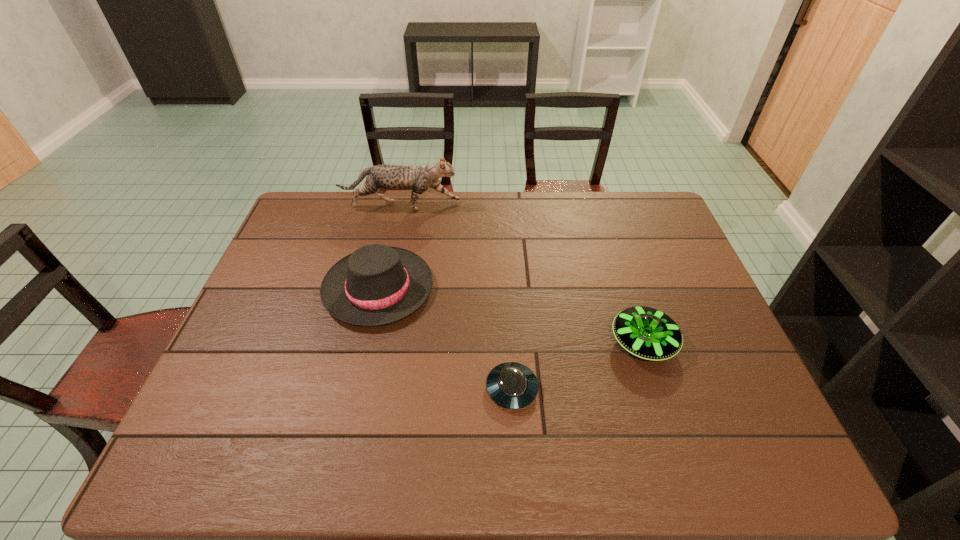
Find the location of a particular element. vacant space located 0.210m on the back of the second object from right to left is located at coordinates (507, 304).

You are a GUI agent. You are given a task and a screenshot of the screen. Output one action in this format:
    pyautogui.click(x=<x>, y=<y>)
    Task: Click on the object that is at the far edge
    
    Given the screenshot: What is the action you would take?
    pyautogui.click(x=380, y=178)

Identify the location of object that is at the left edge. This screenshot has height=540, width=960. (380, 178).

Find the location of a particular element. The image size is (960, 540). object at the right edge is located at coordinates click(x=648, y=333).

The height and width of the screenshot is (540, 960). I want to click on object present at the far left corner, so point(380,178).

The width and height of the screenshot is (960, 540). Find the location of `vacant space at the far edge of the desktop`. vacant space at the far edge of the desktop is located at coordinates (401, 213).

Where is `free point at the near edge`? free point at the near edge is located at coordinates (706, 465).

This screenshot has height=540, width=960. Find the location of `free space at the left edge of the desktop`. free space at the left edge of the desktop is located at coordinates (252, 339).

This screenshot has height=540, width=960. In the image, there is a desktop. Identify the location of vacant region at the right edge. (691, 322).

In the image, there is a desktop. At what (x,y) coordinates should I click in order to perform the action: click on free region at the near left corner. Please return your answer as a coordinate pair (x, y). Looking at the image, I should click on (218, 434).